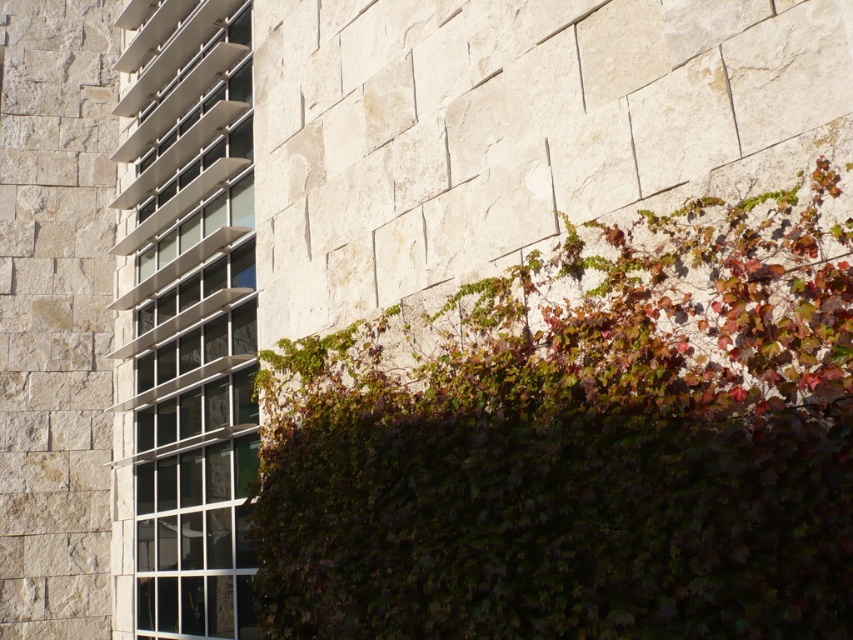
You are standing in front of the building and want to locate the green leafy hedge at upper right. What are its coordinates in the image?

The green leafy hedge at upper right is located at coordinates point [579,442].

Looking at this image, you are a gardener assessing the exterior of a building. You notice the green leafy hedge at upper right and the metallic glass window at left. Which object is taller?

The green leafy hedge at upper right is taller than the metallic glass window at left according to the description.

You are standing in front of the building and notice the green leafy hedge at upper right and the metallic glass window at left. Which object is nearer to you?

The green leafy hedge at upper right is closer to the viewer than the metallic glass window at left.